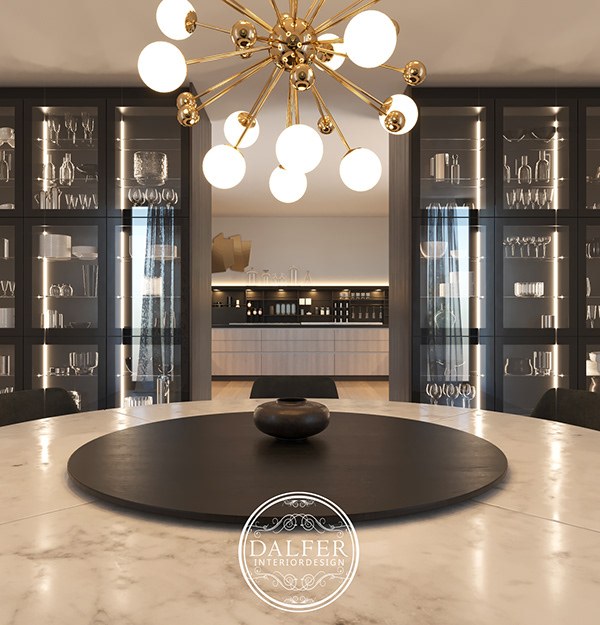
Image resolution: width=600 pixels, height=625 pixels. I want to click on glass case, so 444,310.